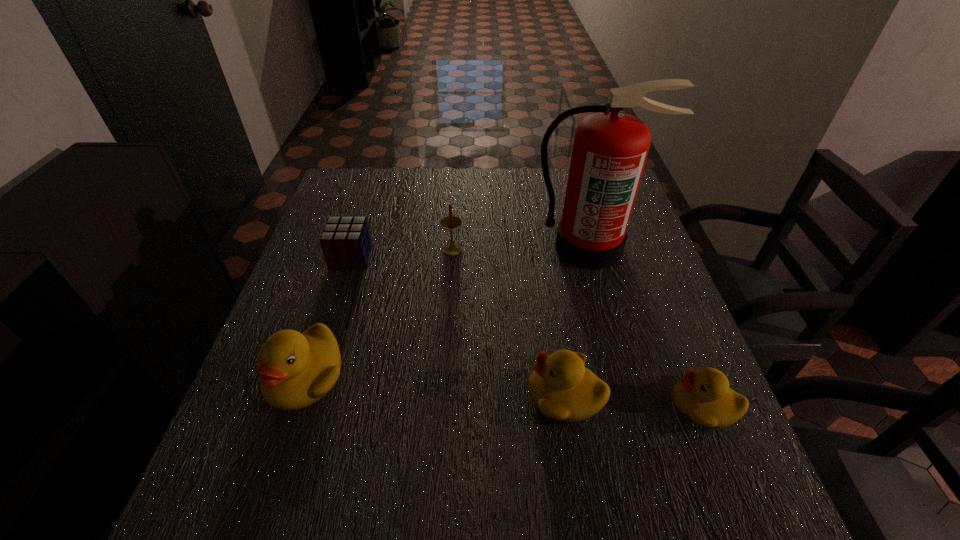
Find the location of `the third closest duckling to the candle`. the third closest duckling to the candle is located at coordinates (703, 397).

Find the location of a particular element. the closest duckling to the shortest duckling is located at coordinates (561, 387).

Where is `free space that satisfies the following two spatial constraints: 1. at the nozzle of the tallest object; 2. on the front-facing side of the third shortest object`? The height and width of the screenshot is (540, 960). free space that satisfies the following two spatial constraints: 1. at the nozzle of the tallest object; 2. on the front-facing side of the third shortest object is located at coordinates (630, 395).